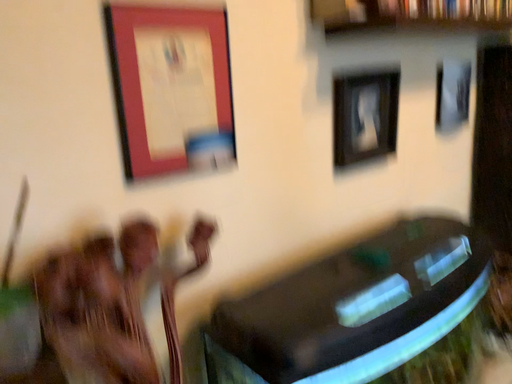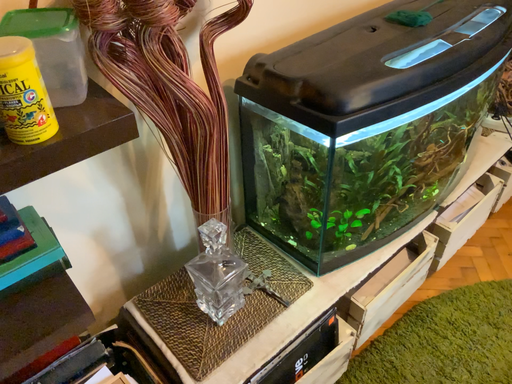
Question: How did the camera likely rotate when shooting the video?

Choices:
 (A) rotated upward
 (B) rotated downward

Answer: (B)